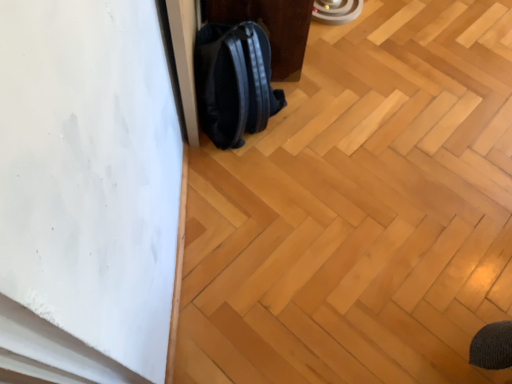
The height and width of the screenshot is (384, 512). In order to click on free space between black leather backpack at lower left and black matte backpack at center in this screenshot , I will do `click(295, 109)`.